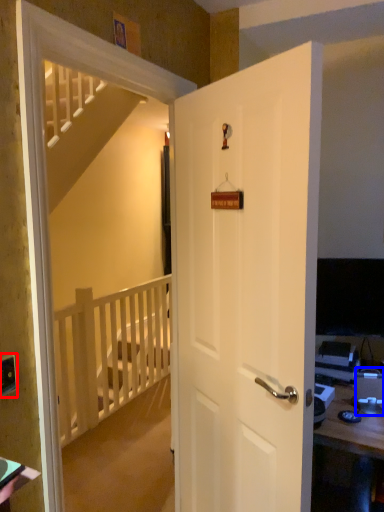
Question: Which object is closer to the camera taking this photo, electric outlet (highlighted by a red box) or desktop computer (highlighted by a blue box)?

Choices:
 (A) electric outlet
 (B) desktop computer

Answer: (A)